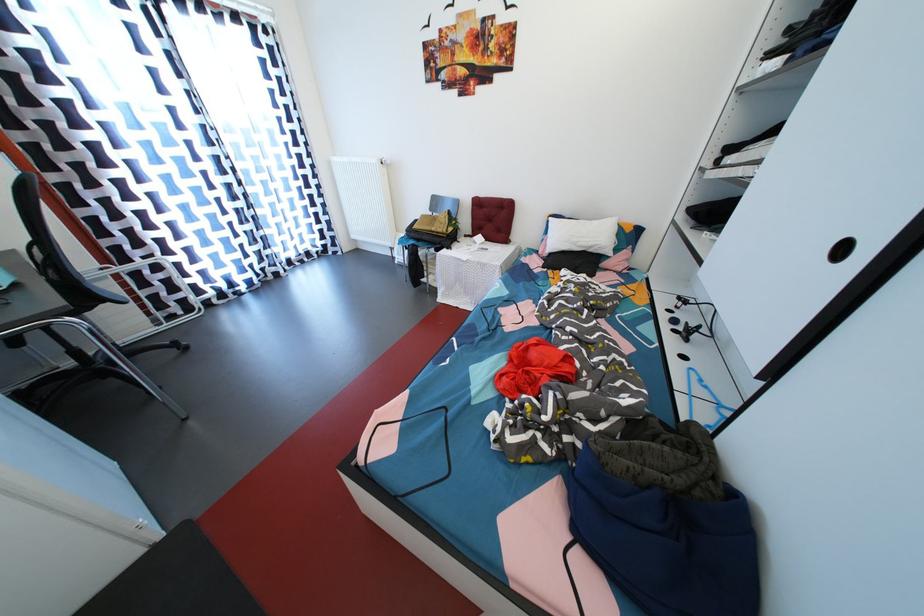
You are a GUI agent. You are given a task and a screenshot of the screen. Output one action in this format:
    pyautogui.click(x=<x>, y=<y>)
    Task: Click on the recessed cabinet handle
    
    Given the screenshot: What is the action you would take?
    pyautogui.click(x=841, y=249)